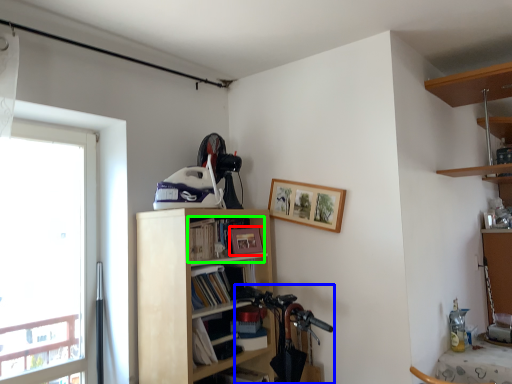
Question: Which object is the closest to the picture frame (highlighted by a red box)? Choose among these: mountain bike (highlighted by a blue box) or book (highlighted by a green box).

Choices:
 (A) mountain bike
 (B) book

Answer: (B)